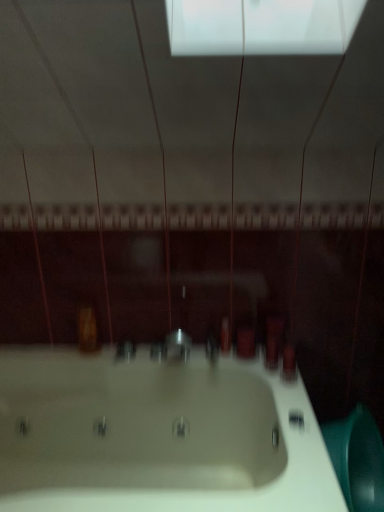
What do you see at coordinates (157, 435) in the screenshot?
I see `white glossy sink at center` at bounding box center [157, 435].

You are a GUI agent. You are given a task and a screenshot of the screen. Output one action in this format:
    pyautogui.click(x=<x>, y=<y>)
    Task: Click on the white glossy sink at center
    
    Given the screenshot: What is the action you would take?
    point(157,435)

Find the location of `white glossy sink at center`. white glossy sink at center is located at coordinates (157, 435).